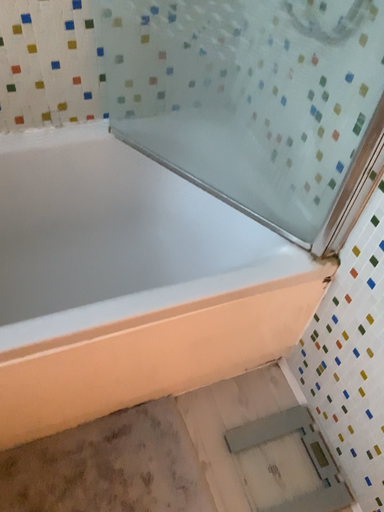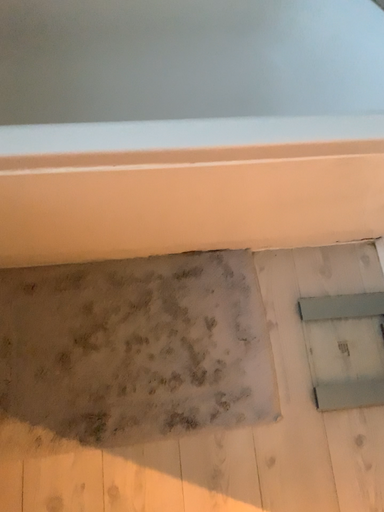
Question: Which way did the camera rotate in the video?

Choices:
 (A) rotated right
 (B) rotated left

Answer: (B)